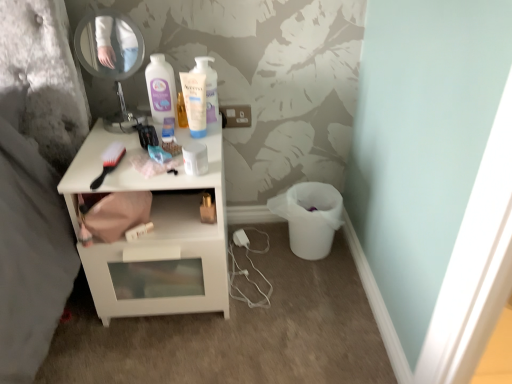
This screenshot has height=384, width=512. What are the coordinates of `free space to the left of black plastic brush at upper left` in the screenshot? It's located at (77, 173).